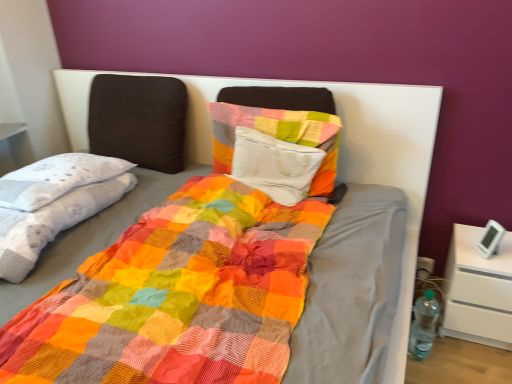
Question: Considering the positions of multicolored patchwork blanket at left and textured cotton pillow at center in the image, is multicolored patchwork blanket at left taller or shorter than textured cotton pillow at center?

Choices:
 (A) short
 (B) tall

Answer: (A)

Question: Considering their positions, is multicolored patchwork blanket at left located in front of or behind textured cotton pillow at center?

Choices:
 (A) front
 (B) behind

Answer: (A)

Question: Which of these objects is positioned farthest from the multicolored patchwork blanket at left?

Choices:
 (A) textured cotton pillow at center
 (B) white matte nightstand at lower right
 (C) clear plastic bottle at right

Answer: (B)

Question: Estimate the real-world distances between objects in this image. Which object is farther from the white matte nightstand at lower right?

Choices:
 (A) textured cotton pillow at center
 (B) multicolored patchwork blanket at left
 (C) clear plastic bottle at right

Answer: (B)